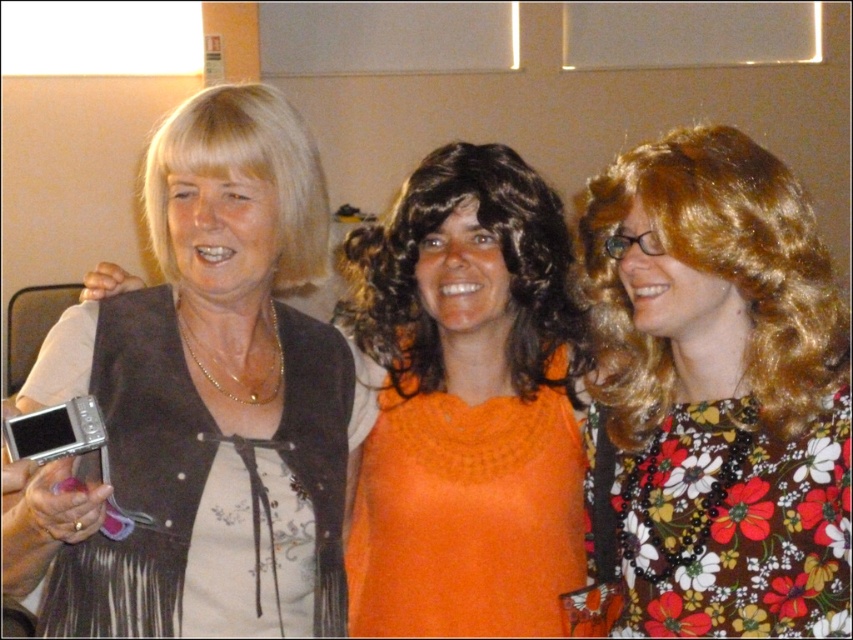
Does matte black vest at left appear on the left side of floral print dress at center?

Indeed, matte black vest at left is positioned on the left side of floral print dress at center.

Between matte black vest at left and floral print dress at center, which one appears on the right side from the viewer's perspective?

Positioned to the right is floral print dress at center.

Which is in front, point (248, 419) or point (677, 516)?

Positioned in front is point (677, 516).

The height and width of the screenshot is (640, 853). Find the location of `matte black vest at left`. matte black vest at left is located at coordinates (206, 403).

Does point (228, 234) come behind point (468, 605)?

No, it is not.

Is matte black vest at left positioned in front of orange knitted sweater at center?

Yes.

Which is in front, point (80, 592) or point (482, 490)?

Point (80, 592)

Find the location of `matte black vest at left`. matte black vest at left is located at coordinates (206, 403).

Is floral print dress at center smaller than orange knitted sweater at center?

Indeed, floral print dress at center has a smaller size compared to orange knitted sweater at center.

Is the position of floral print dress at center more distant than that of orange knitted sweater at center?

No, floral print dress at center is closer to the viewer.

Is point (743, 502) less distant than point (555, 365)?

Yes, point (743, 502) is closer to viewer.

Where is `floral print dress at center`? floral print dress at center is located at coordinates (712, 397).